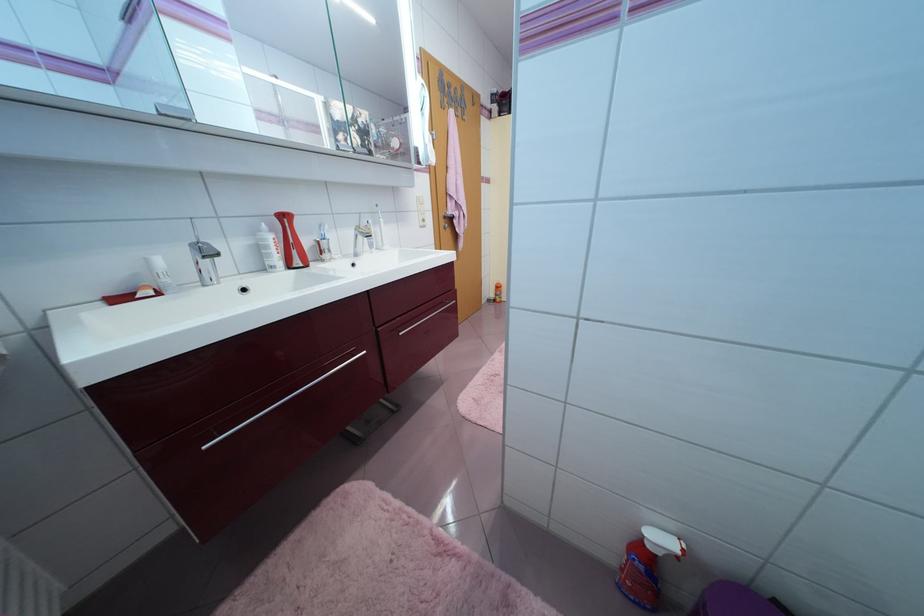
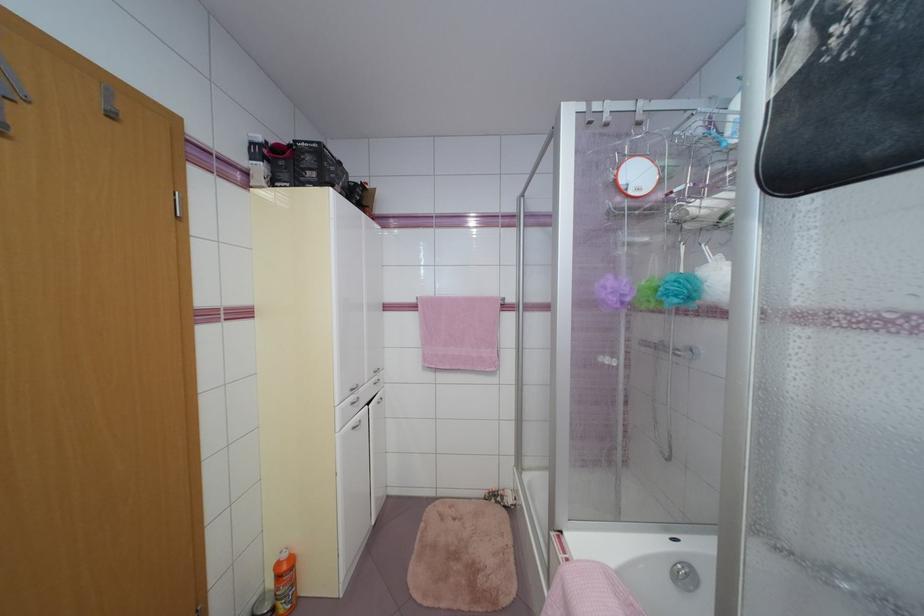
In the second image, find the point that corresponds to (x=505, y=116) in the first image.

(276, 185)